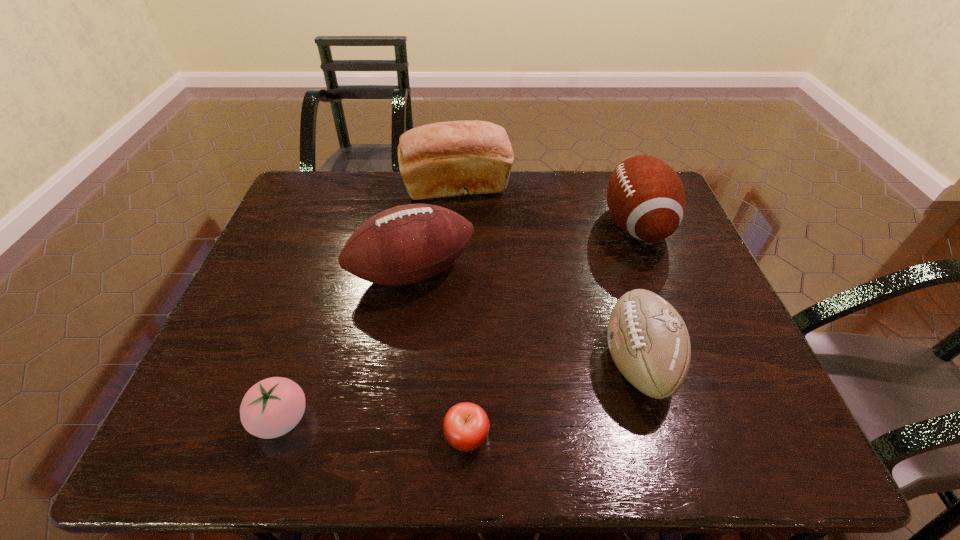
This screenshot has width=960, height=540. What are the coordinates of `vacant space located 0.120m on the laces of the fourth tallest object` in the screenshot? It's located at (547, 361).

Where is `free point located 0.330m on the right of the tomato`? Image resolution: width=960 pixels, height=540 pixels. free point located 0.330m on the right of the tomato is located at coordinates (476, 419).

This screenshot has height=540, width=960. In order to click on vacant region located on the back of the shortest object in this screenshot , I will do `click(468, 338)`.

Where is `bread at the far edge`? Image resolution: width=960 pixels, height=540 pixels. bread at the far edge is located at coordinates (445, 159).

Where is `football present at the far edge`? football present at the far edge is located at coordinates (645, 196).

Find the location of a particular element. This screenshot has width=960, height=540. tomato that is at the near edge is located at coordinates (272, 407).

At what (x,y) coordinates should I click in order to perform the action: click on apple at the near edge. Please return your answer as a coordinate pair (x, y). The height and width of the screenshot is (540, 960). Looking at the image, I should click on (466, 426).

The image size is (960, 540). In order to click on object located in the left edge section of the desktop in this screenshot , I will do `click(272, 407)`.

You are a GUI agent. You are given a task and a screenshot of the screen. Output one action in this format:
    pyautogui.click(x=<x>, y=<y>)
    Task: Click on the object at the right edge
    Image resolution: width=960 pixels, height=540 pixels.
    Given the screenshot: What is the action you would take?
    pyautogui.click(x=645, y=196)

The height and width of the screenshot is (540, 960). I want to click on object at the near left corner, so click(272, 407).